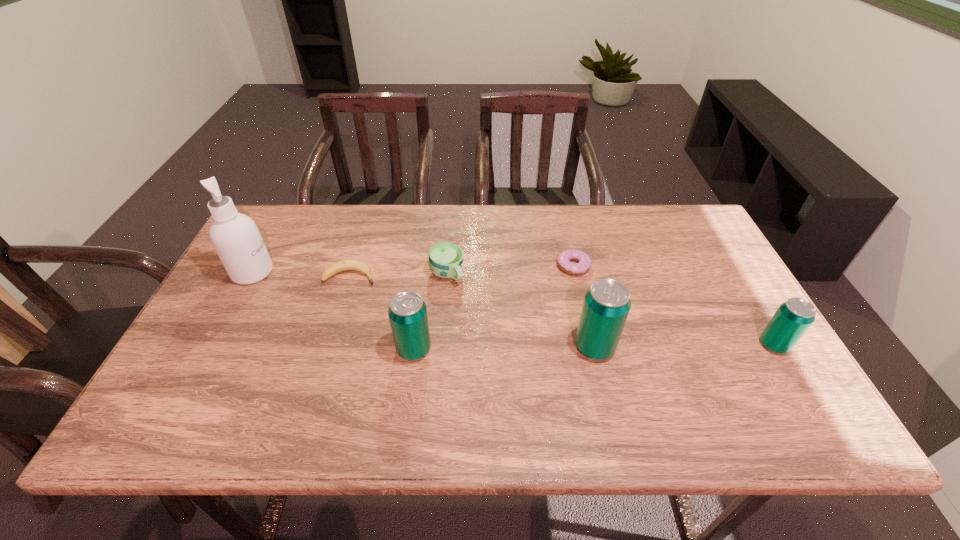
This screenshot has height=540, width=960. I want to click on vacant space situated 0.130m on the right of the leftmost beer can, so click(x=485, y=349).

Where is `blank space located on the left of the second beer can from right to left`? This screenshot has height=540, width=960. blank space located on the left of the second beer can from right to left is located at coordinates (496, 347).

Where is `vacant space located 0.380m on the left of the rightmost object`? vacant space located 0.380m on the left of the rightmost object is located at coordinates (605, 345).

Locate an element on the screen. Image resolution: width=960 pixels, height=540 pixels. vacant space located 0.160m on the back of the cup is located at coordinates (450, 227).

This screenshot has width=960, height=540. What are the coordinates of `free region located on the front label of the cleansing agent` in the screenshot? It's located at 384,272.

What are the coordinates of `vacant point located 0.370m at the stem of the banana` in the screenshot? It's located at (506, 275).

The image size is (960, 540). I want to click on free space located 0.090m on the back of the doughnut, so click(x=566, y=235).

The width and height of the screenshot is (960, 540). Find the location of `object situated at the left edge`. object situated at the left edge is located at coordinates (235, 237).

At what (x,y) coordinates should I click in order to perform the action: click on object present at the right edge. Please return your answer as a coordinate pair (x, y). This screenshot has height=540, width=960. Looking at the image, I should click on (792, 319).

This screenshot has width=960, height=540. In the image, there is a desktop. In order to click on free region at the far edge in this screenshot , I will do `click(619, 214)`.